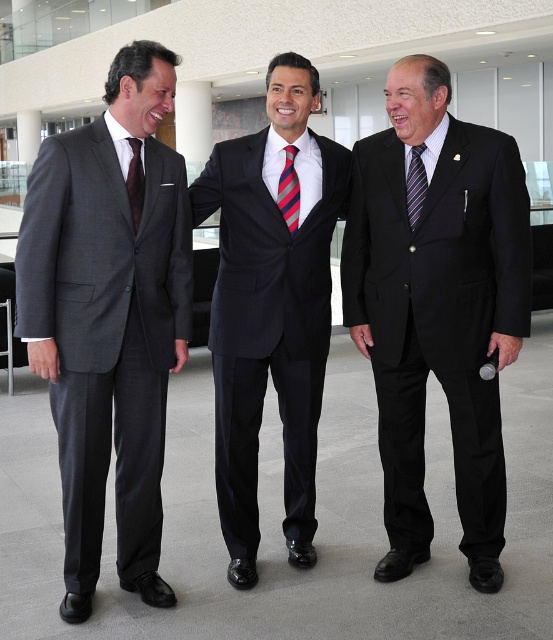
Does striped silk tie at right appear under dark brown silk tie at left?

Actually, striped silk tie at right is above dark brown silk tie at left.

Who is lower down, striped silk tie at right or dark brown silk tie at left?

dark brown silk tie at left is lower down.

Measure the distance between striped silk tie at right and camera.

striped silk tie at right is 3.80 meters from camera.

The image size is (553, 640). In order to click on striped silk tie at right in this screenshot , I will do pos(415,184).

Between black suit at center and striped silk tie at center, which one appears on the right side from the viewer's perspective?

striped silk tie at center

Between black suit at center and striped silk tie at center, which one appears on the left side from the viewer's perspective?

black suit at center

Who is more distant from viewer, (284, 134) or (294, 224)?

The point (284, 134) is behind.

This screenshot has width=553, height=640. What are the coordinates of `black suit at center` in the screenshot? It's located at (x=270, y=308).

Is black smooth suit at center below dark brown silk tie at left?

Indeed, black smooth suit at center is positioned under dark brown silk tie at left.

Is point (461, 401) closer to viewer compared to point (139, 173)?

No.

I want to click on black smooth suit at center, so click(437, 307).